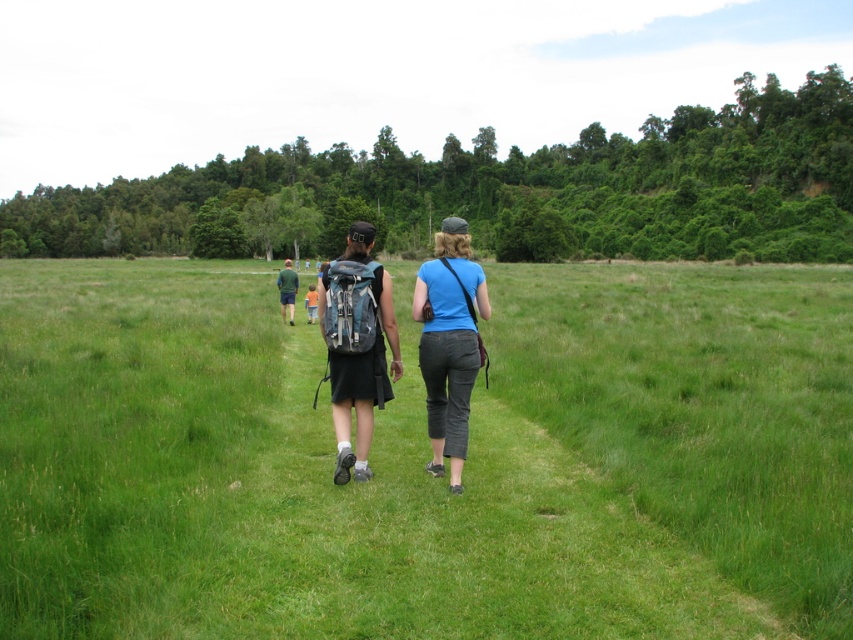
You are standing at the starting point of the path and want to reach the point that is closer to you. Which point should you head towards, point [468,288] or point [416,282]?

Point [468,288] is closer to the viewer than point [416,282], so you should head towards point [468,288].

You are a photographer trying to capture a photo of the blue cotton shirt at center without the green grass at center blocking the view. Is this possible given their positions?

The green grass at center is located above the blue cotton shirt at center, so it will block the view. To capture the blue cotton shirt at center without the grass, you need to adjust your angle or move lower to avoid the grass.